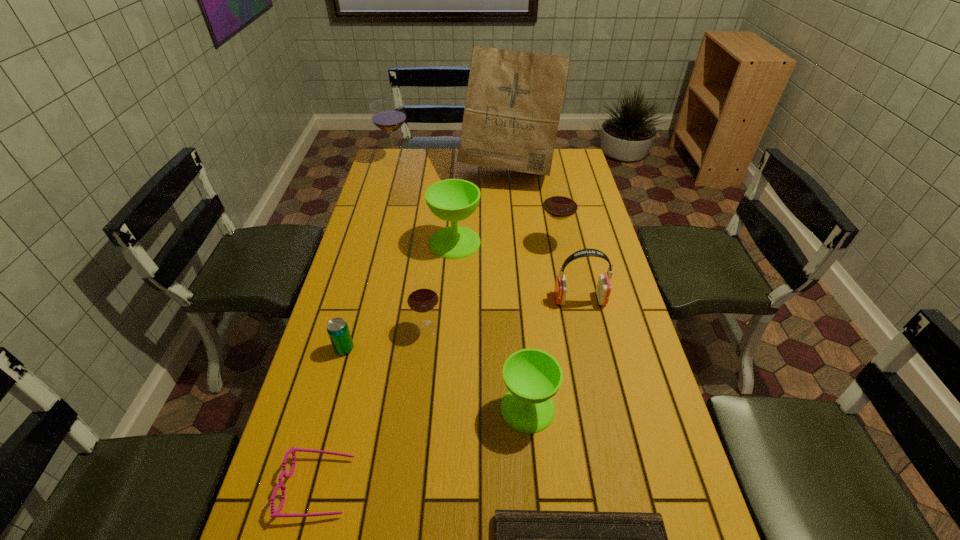
The image size is (960, 540). I want to click on free location at the left edge of the desktop, so click(326, 357).

You are a GUI agent. You are given a task and a screenshot of the screen. Output one action in this format:
    pyautogui.click(x=<x>, y=<y>)
    Task: Click on the vacant region at the right edge of the desktop
    Image resolution: width=960 pixels, height=540 pixels.
    Given the screenshot: What is the action you would take?
    pyautogui.click(x=633, y=417)

I want to click on vacant space at the far right corner of the desktop, so click(580, 170).

The height and width of the screenshot is (540, 960). Identify the location of empty location between the farthest wineglass and the earphone. (488, 230).

The width and height of the screenshot is (960, 540). I want to click on vacant area between the biggest red wineglass and the right green wineglass, so click(462, 285).

This screenshot has width=960, height=540. Find the location of `empty space that is in between the nearest red wineglass and the earphone`. empty space that is in between the nearest red wineglass and the earphone is located at coordinates (503, 314).

The image size is (960, 540). Identify the location of vacant space that is in between the nearest red wineglass and the pink earphone. (503, 314).

At what (x,y) coordinates should I click in order to perform the action: click on free point between the spectacles and the rightmost wineglass. Please return your answer as a coordinate pair (x, y). The image size is (960, 540). Looking at the image, I should click on (437, 365).

At what (x,y) coordinates should I click in order to perform the action: click on vacant area between the left green wineglass and the earphone. Please return your answer as a coordinate pair (x, y). The width and height of the screenshot is (960, 540). Looking at the image, I should click on (517, 271).

Where is `vacant region between the right green wineglass and the left green wineglass`? The width and height of the screenshot is (960, 540). vacant region between the right green wineglass and the left green wineglass is located at coordinates (492, 325).